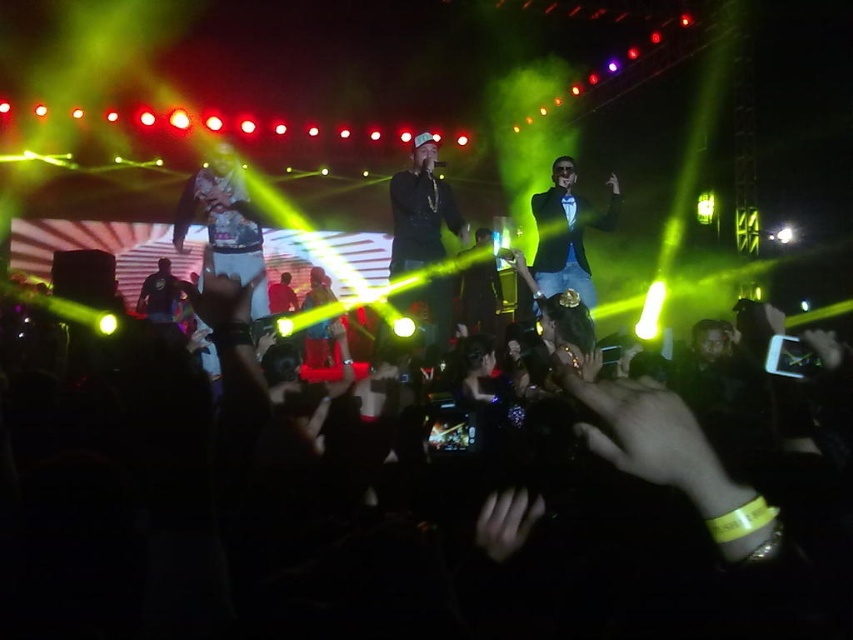
Question: Based on their relative distances, which object is farther from the blue satin blazer at center?

Choices:
 (A) black fabric crowd at lower center
 (B) black leather jacket at center

Answer: (A)

Question: Which point is farther to the camera?

Choices:
 (A) (485, 593)
 (B) (428, 148)

Answer: (B)

Question: In this image, where is black fabric crowd at lower center located relative to black leather jacket at center?

Choices:
 (A) left
 (B) right

Answer: (A)

Question: Can you confirm if black fabric crowd at lower center is wider than black leather jacket at center?

Choices:
 (A) yes
 (B) no

Answer: (A)

Question: Can you confirm if black fabric crowd at lower center is thinner than blue satin blazer at center?

Choices:
 (A) no
 (B) yes

Answer: (A)

Question: Estimate the real-world distances between objects in this image. Which object is farther from the black leather jacket at center?

Choices:
 (A) blue satin blazer at center
 (B) black fabric crowd at lower center

Answer: (B)